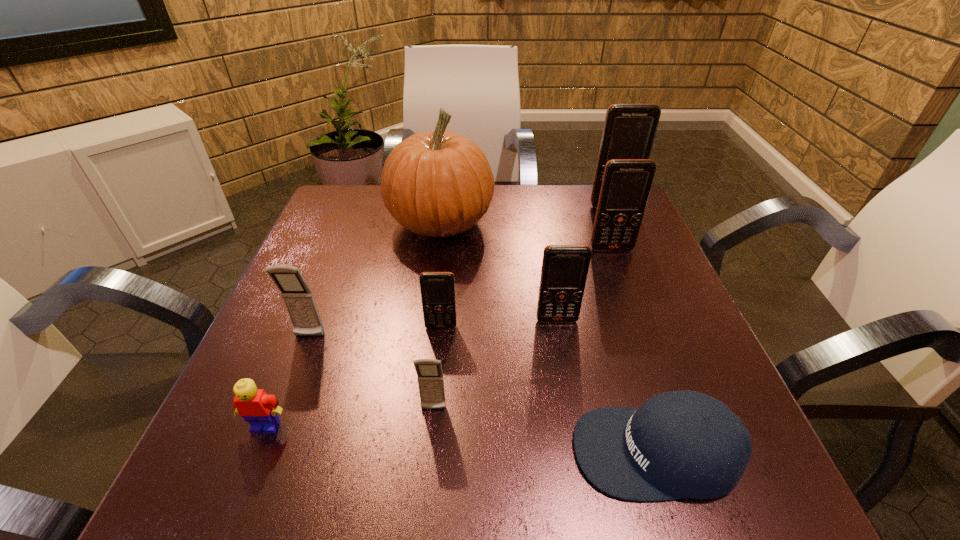
Where is `free space located 0.180m on the screen of the leftmost orange cellular telephone`? Image resolution: width=960 pixels, height=540 pixels. free space located 0.180m on the screen of the leftmost orange cellular telephone is located at coordinates (433, 414).

At what (x,y) coordinates should I click in order to perform the action: click on vacant region located on the front-facing side of the yellow Lego. Please return your answer as a coordinate pair (x, y). The image size is (960, 540). Looking at the image, I should click on (250, 466).

In order to click on vacant area situated on the front-facing side of the baseball cap in this screenshot , I will do `click(318, 451)`.

You are a GUI agent. You are given a task and a screenshot of the screen. Output one action in this format:
    pyautogui.click(x=<x>, y=<y>)
    Task: Click on the vacant space situated 0.110m on the front-facing side of the baseball cap
    Image resolution: width=960 pixels, height=540 pixels.
    Given the screenshot: What is the action you would take?
    click(500, 451)

Locate an element on the screen. The image size is (960, 540). vacant space situated on the front-facing side of the baseball cap is located at coordinates pos(399,451).

Locate an element on the screen. Image resolution: width=960 pixels, height=540 pixels. pumpkin positioned at the far edge is located at coordinates (437, 184).

Identify the location of cellular telephone at the far edge. This screenshot has height=540, width=960. (629, 131).

You are a GUI agent. You are given a task and a screenshot of the screen. Output one action in this format:
    pyautogui.click(x=<x>, y=<y>)
    Task: Click on the object located at the near edge
    This screenshot has width=960, height=540.
    Given the screenshot: What is the action you would take?
    pyautogui.click(x=678, y=444)

I want to click on cellular telephone positioned at the left edge, so click(299, 301).

Find the location of a particular element. Lego that is at the left edge is located at coordinates (256, 407).